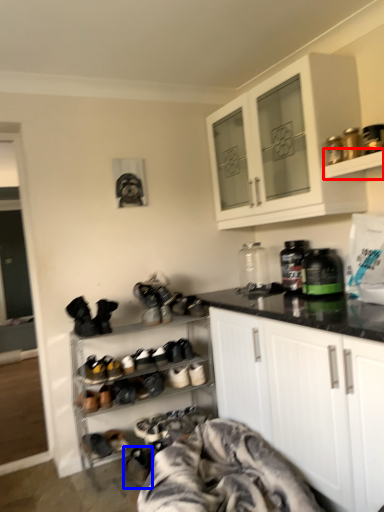
Question: Which object is further to the camera taking this photo, shelf (highlighted by a red box) or footwear (highlighted by a blue box)?

Choices:
 (A) shelf
 (B) footwear

Answer: (B)